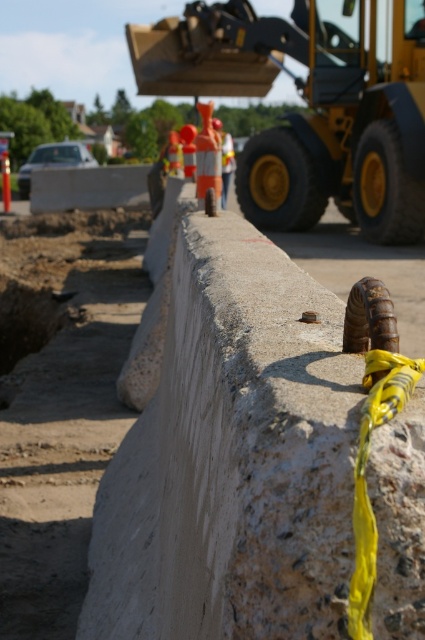
Which is behind, point (351, 164) or point (232, 140)?

The point (232, 140) is more distant.

How much distance is there between yellow rubber excavator at upper center and orange reflective vest at center?

yellow rubber excavator at upper center is 14.76 feet away from orange reflective vest at center.

Who is more forward, (333, 83) or (227, 186)?

Point (333, 83) is more forward.

Where is `yellow rubber excavator at upper center`? Image resolution: width=425 pixels, height=640 pixels. yellow rubber excavator at upper center is located at coordinates (308, 108).